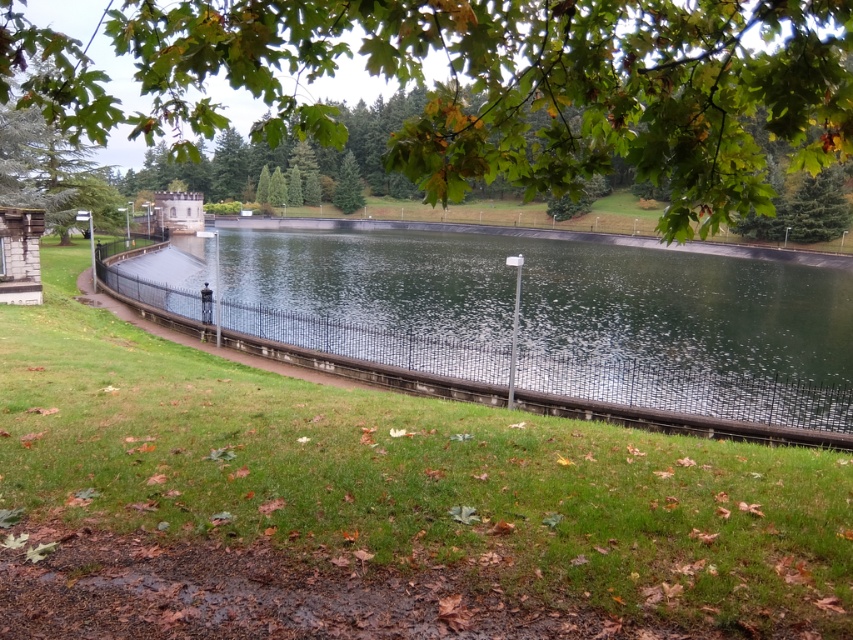
Image resolution: width=853 pixels, height=640 pixels. Describe the element at coordinates (379, 502) in the screenshot. I see `green grass at center` at that location.

Is point (282, 417) less distant than point (483, 355)?

That is True.

Locate an element on the screen. Image resolution: width=853 pixels, height=640 pixels. green grass at center is located at coordinates (379, 502).

Can you confirm if green leafy tree at upper center is positioned above green matte tree at center?

No.

Who is taller, green leafy tree at upper center or green matte tree at center?

With more height is green leafy tree at upper center.

Where is `green leafy tree at upper center`? Image resolution: width=853 pixels, height=640 pixels. green leafy tree at upper center is located at coordinates [486, 84].

Can you confirm if green leafy tree at upper center is positioned to the left of clear glass water at center?

Yes, green leafy tree at upper center is to the left of clear glass water at center.

Who is lower down, green leafy tree at upper center or clear glass water at center?

clear glass water at center is below.

Find the location of a particular element. Image resolution: width=853 pixels, height=640 pixels. green leafy tree at upper center is located at coordinates (486, 84).